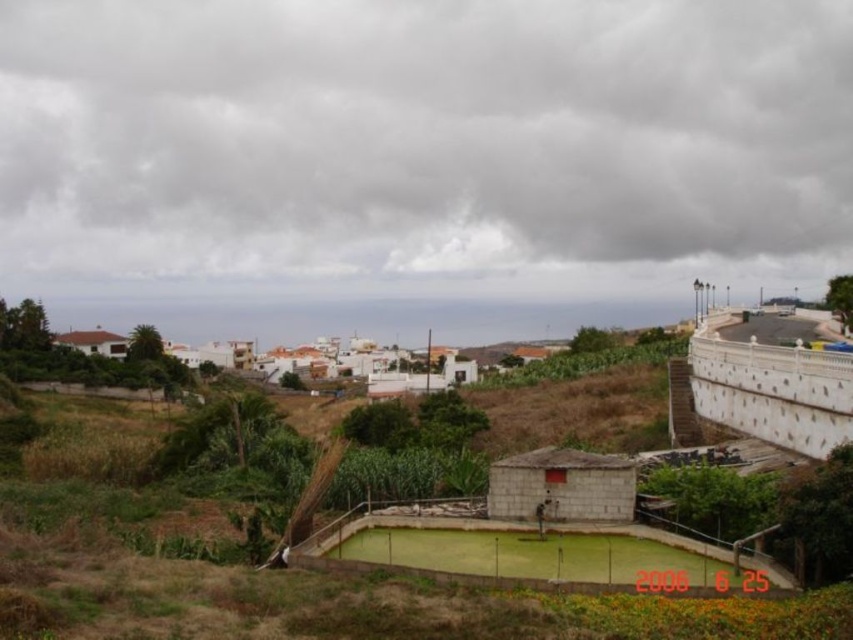
Question: Does cloudy gray sky at upper center appear on the left side of white matte houses at center?

Choices:
 (A) yes
 (B) no

Answer: (B)

Question: Which of the following is the closest to the observer?

Choices:
 (A) cloudy gray sky at upper center
 (B) white matte houses at center

Answer: (B)

Question: In this image, where is cloudy gray sky at upper center located relative to white matte houses at center?

Choices:
 (A) below
 (B) above

Answer: (B)

Question: Which point is closer to the camera?

Choices:
 (A) (136, 188)
 (B) (476, 369)

Answer: (B)

Question: Is cloudy gray sky at upper center below white matte houses at center?

Choices:
 (A) yes
 (B) no

Answer: (B)